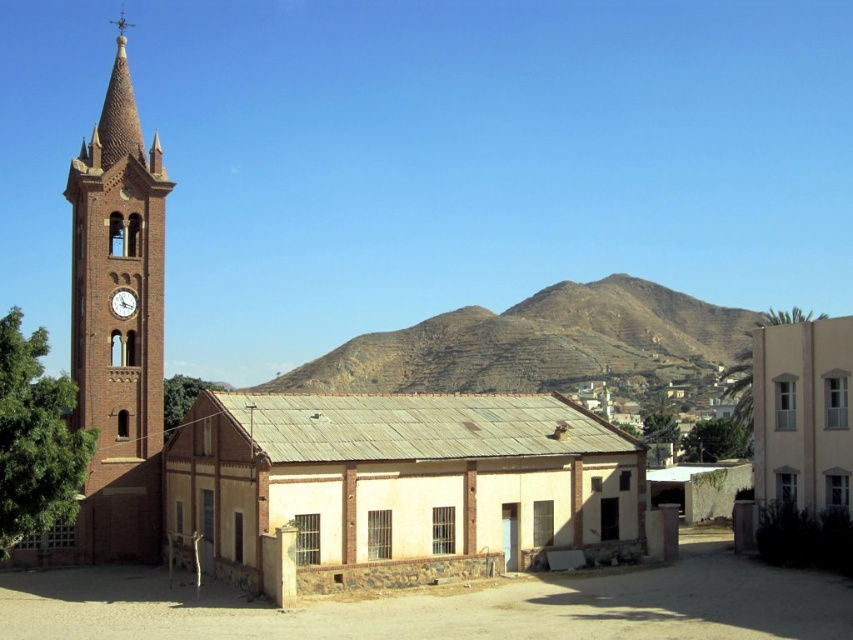
You are standing at the center of the image and want to walk towards the brick clock tower at left. In which direction should you head?

The brick clock tower at left is located at point [119,324], which is to the left side of the image. Therefore, you should head to the left to reach it.

You are a delivery person with a cart that is 2 meters wide. You need to navigate between the light beige brick building at center and the matte brown clock at left. Can your cart fit through the space between them?

The light beige brick building at center and the matte brown clock at left are 15.30 meters apart from each other. Since your cart is only 2 meters wide, it can easily fit through the space between them as the distance is much wider than the cart.